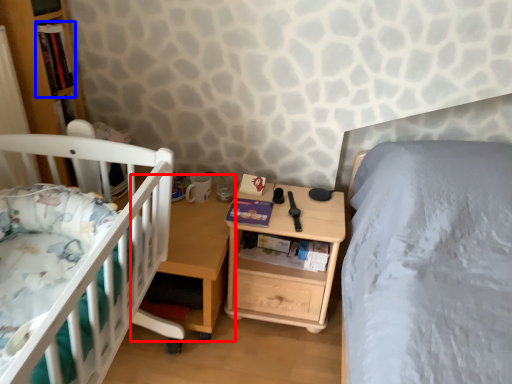
Question: Which object appears closest to the camera in this image, table (highlighted by a red box) or book (highlighted by a blue box)?

Choices:
 (A) table
 (B) book

Answer: (A)